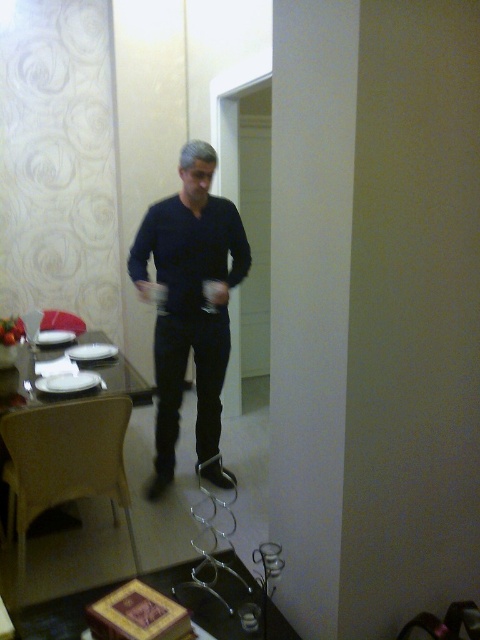
Does dark blue shirt at center appear under white glossy table at left?

Incorrect, dark blue shirt at center is not positioned below white glossy table at left.

Is dark blue shirt at center thinner than white glossy table at left?

Correct, dark blue shirt at center's width is less than white glossy table at left's.

Describe the element at coordinates (190, 301) in the screenshot. The height and width of the screenshot is (640, 480). I see `dark blue shirt at center` at that location.

Identify the location of dark blue shirt at center. Image resolution: width=480 pixels, height=640 pixels. (190, 301).